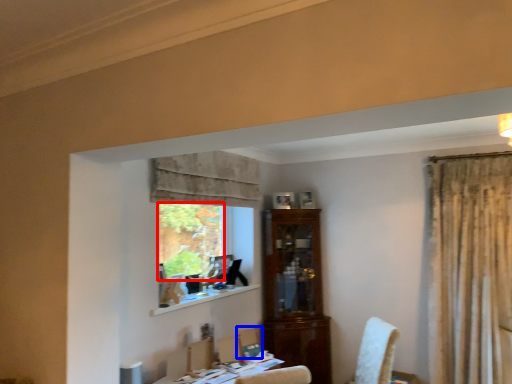
Question: Among these objects, which one is nearest to the camera, window screen (highlighted by a red box) or chair (highlighted by a blue box)?

Choices:
 (A) window screen
 (B) chair

Answer: (B)